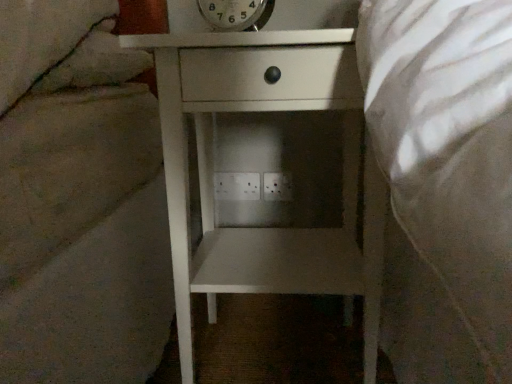
Question: From the image's perspective, is metallic silver clock at upper center beneath white plastic electric outlet at center, which is the 1th electric outlet in left-to-right order?

Choices:
 (A) no
 (B) yes

Answer: (A)

Question: Can you confirm if metallic silver clock at upper center is shorter than white plastic electric outlet at center, which is the 1th electric outlet in left-to-right order?

Choices:
 (A) no
 (B) yes

Answer: (A)

Question: Is metallic silver clock at upper center at the left side of white plastic electric outlet at center, positioned as the second electric outlet in right-to-left order?

Choices:
 (A) no
 (B) yes

Answer: (A)

Question: Is metallic silver clock at upper center beside white plastic electric outlet at center, which is the 1th electric outlet in left-to-right order?

Choices:
 (A) no
 (B) yes

Answer: (A)

Question: Can you confirm if metallic silver clock at upper center is taller than white plastic electric outlet at center, positioned as the second electric outlet in right-to-left order?

Choices:
 (A) no
 (B) yes

Answer: (B)

Question: Is white plastic electric outlet at center, positioned as the second electric outlet in right-to-left order, in front of or behind white plastic electric outlet at center, arranged as the 2th electric outlet when viewed from the left, in the image?

Choices:
 (A) behind
 (B) front

Answer: (A)

Question: Is white plastic electric outlet at center, positioned as the second electric outlet in right-to-left order, to the left or to the right of white plastic electric outlet at center, which appears as the 1th electric outlet when viewed from the right, in the image?

Choices:
 (A) right
 (B) left

Answer: (B)

Question: From the image's perspective, is white plastic electric outlet at center, which is the 1th electric outlet in left-to-right order, above or below white plastic electric outlet at center, arranged as the 2th electric outlet when viewed from the left?

Choices:
 (A) below
 (B) above

Answer: (B)

Question: Considering the positions of white plastic electric outlet at center, which is the 1th electric outlet in left-to-right order, and white plastic electric outlet at center, arranged as the 2th electric outlet when viewed from the left, in the image, is white plastic electric outlet at center, which is the 1th electric outlet in left-to-right order, taller or shorter than white plastic electric outlet at center, arranged as the 2th electric outlet when viewed from the left,?

Choices:
 (A) short
 (B) tall

Answer: (A)

Question: From a real-world perspective, is white matte nightstand at center above or below white plastic electric outlet at center, which appears as the 1th electric outlet when viewed from the right?

Choices:
 (A) below
 (B) above

Answer: (B)

Question: From the image's perspective, is white matte nightstand at center above or below white plastic electric outlet at center, arranged as the 2th electric outlet when viewed from the left?

Choices:
 (A) above
 (B) below

Answer: (B)

Question: Visually, is white matte nightstand at center positioned to the left or to the right of white plastic electric outlet at center, arranged as the 2th electric outlet when viewed from the left?

Choices:
 (A) right
 (B) left

Answer: (B)

Question: Considering the positions of white matte nightstand at center and white plastic electric outlet at center, arranged as the 2th electric outlet when viewed from the left, in the image, is white matte nightstand at center wider or thinner than white plastic electric outlet at center, arranged as the 2th electric outlet when viewed from the left,?

Choices:
 (A) wide
 (B) thin

Answer: (A)

Question: In terms of height, does white matte nightstand at center look taller or shorter compared to white plastic electric outlet at center, positioned as the second electric outlet in right-to-left order?

Choices:
 (A) tall
 (B) short

Answer: (A)

Question: Is white matte nightstand at center situated inside white plastic electric outlet at center, which is the 1th electric outlet in left-to-right order, or outside?

Choices:
 (A) outside
 (B) inside

Answer: (A)